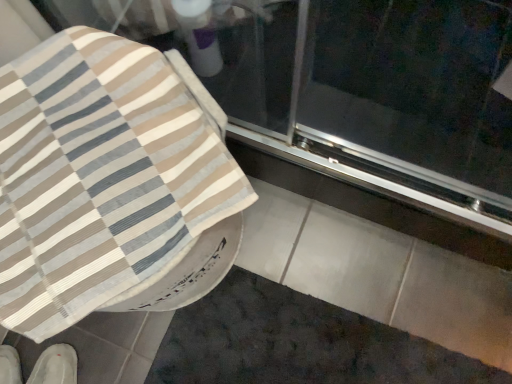
I want to click on vacant region below dark gray textured bath mat at lower center (from a real-world perspective), so click(x=296, y=348).